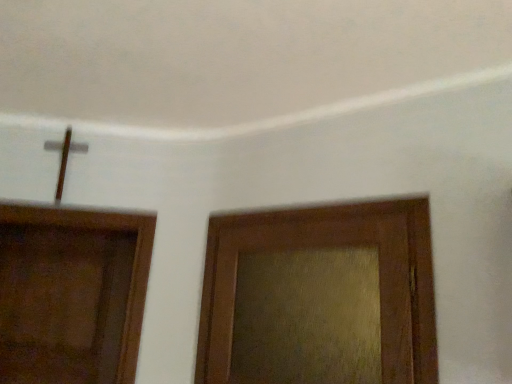
Question: From a real-world perspective, relative to brown wooden door at left, which is counted as the 1th door, starting from the back, is wooden textured door at right, placed as the 1th door when sorted from right to left, vertically above or below?

Choices:
 (A) above
 (B) below

Answer: (A)

Question: Would you say wooden textured door at right, placed as the second door when sorted from back to front, is inside or outside brown wooden door at left, positioned as the 2th door in right-to-left order?

Choices:
 (A) outside
 (B) inside

Answer: (A)

Question: Is wooden textured door at right, placed as the second door when sorted from back to front, to the left or to the right of brown wooden door at left, placed as the first door when sorted from left to right, in the image?

Choices:
 (A) right
 (B) left

Answer: (A)

Question: Considering the positions of point coord(53,301) and point coord(217,243), is point coord(53,301) closer or farther from the camera than point coord(217,243)?

Choices:
 (A) closer
 (B) farther

Answer: (B)

Question: From the image's perspective, is brown wooden door at left, placed as the first door when sorted from left to right, positioned above or below wooden textured door at right, placed as the 1th door when sorted from right to left?

Choices:
 (A) above
 (B) below

Answer: (B)

Question: Considering the positions of brown wooden door at left, which ranks as the 2th door in front-to-back order, and wooden textured door at right, which ranks as the 1th door in front-to-back order, in the image, is brown wooden door at left, which ranks as the 2th door in front-to-back order, taller or shorter than wooden textured door at right, which ranks as the 1th door in front-to-back order,?

Choices:
 (A) tall
 (B) short

Answer: (A)

Question: Looking at their shapes, would you say brown wooden door at left, positioned as the 2th door in right-to-left order, is wider or thinner than wooden textured door at right, which ranks as the 1th door in front-to-back order?

Choices:
 (A) wide
 (B) thin

Answer: (A)